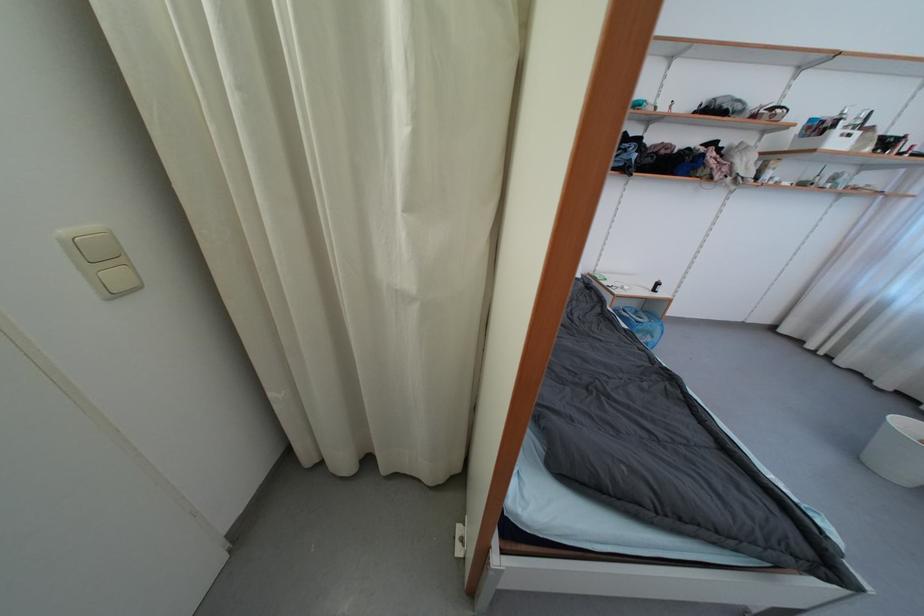
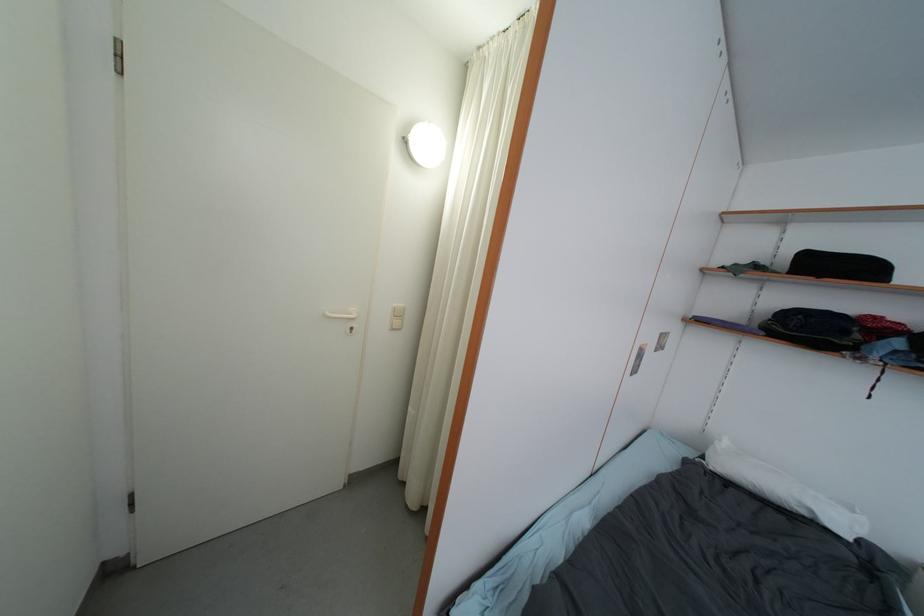
Question: How did the camera likely rotate?

Choices:
 (A) Left
 (B) Right
 (C) Up
 (D) Down

Answer: (A)